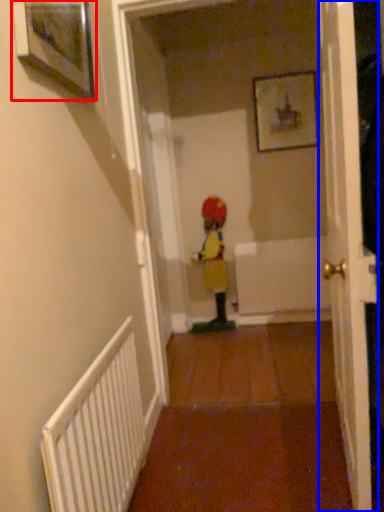
Question: Among these objects, which one is farthest to the camera, picture frame (highlighted by a red box) or door (highlighted by a blue box)?

Choices:
 (A) picture frame
 (B) door

Answer: (A)